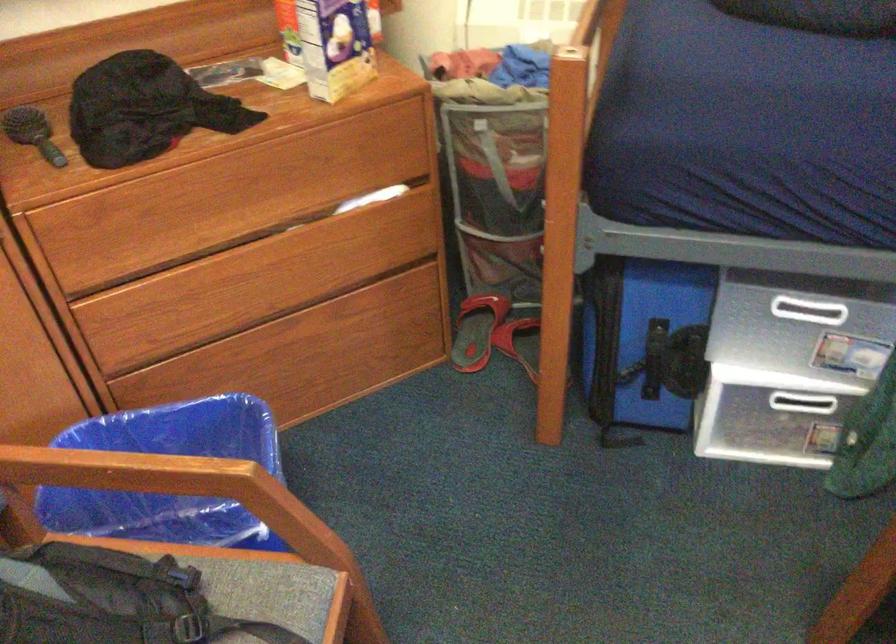
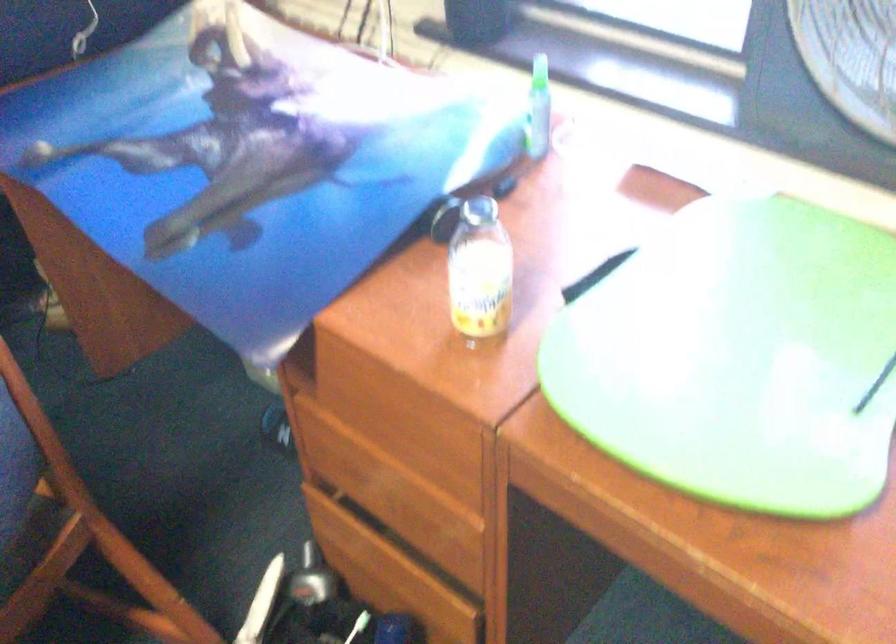
Looking at this image, how did the camera likely rotate?

The camera rotated toward right-down.